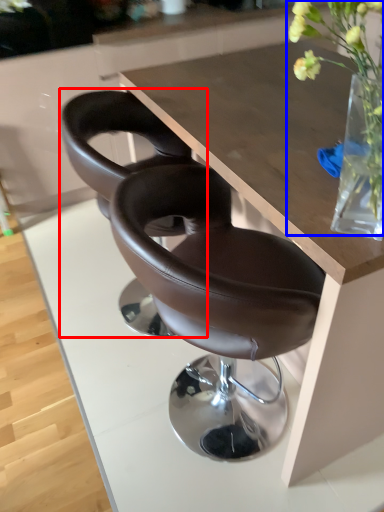
Question: Which point is further to the camera, chair (highlighted by a red box) or floral arrangement (highlighted by a blue box)?

Choices:
 (A) chair
 (B) floral arrangement

Answer: (A)